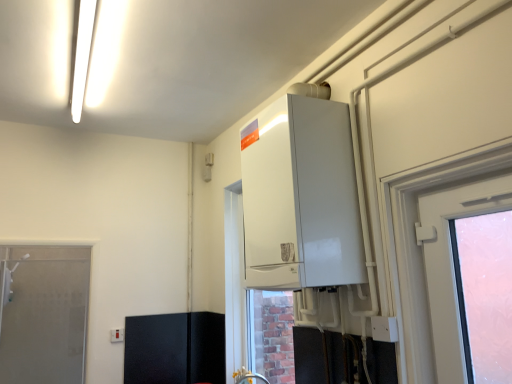
Question: Is point (68, 246) positioned closer to the camera than point (245, 382)?

Choices:
 (A) closer
 (B) farther

Answer: (B)

Question: Is frosted glass door at left bigger or smaller than matte silver faucet at lower center?

Choices:
 (A) big
 (B) small

Answer: (A)

Question: Estimate the real-world distances between objects in this image. Which object is closer to the matte silver faucet at lower center?

Choices:
 (A) frosted glass door at left
 (B) black leather cabinet at lower left
 (C) white glossy boiler at upper center

Answer: (B)

Question: Considering the real-world distances, which object is closest to the black leather cabinet at lower left?

Choices:
 (A) frosted glass door at left
 (B) matte silver faucet at lower center
 (C) white glossy boiler at upper center

Answer: (B)